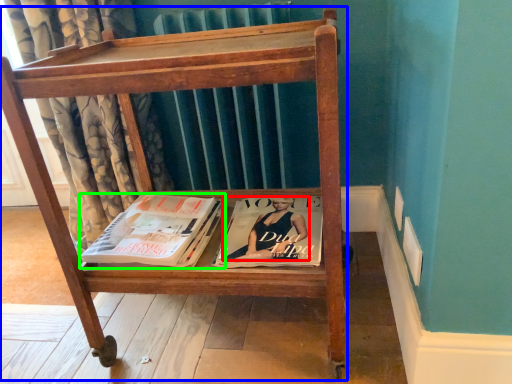
Question: Which is nearer to the person (highlighted by a red box)? furniture (highlighted by a blue box) or book (highlighted by a green box).

Choices:
 (A) furniture
 (B) book

Answer: (B)